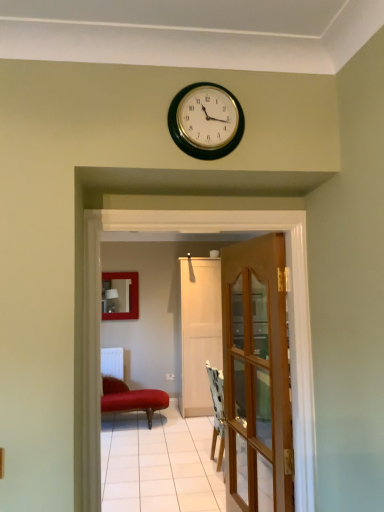
Locate an element on the screen. vacant space to the left of patterned fabric chair at center is located at coordinates (191, 463).